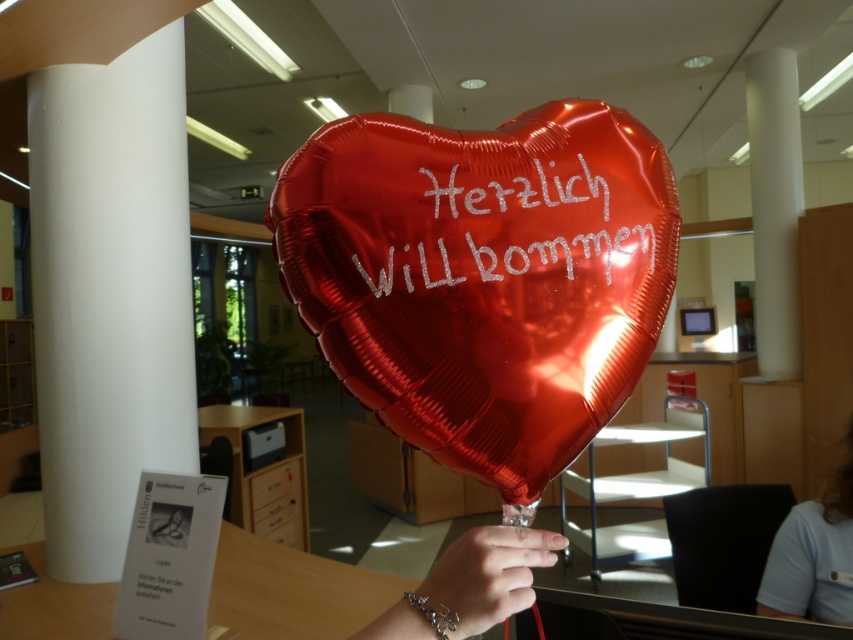
Who is lower down, white smooth pillar at left or white smooth pillar at right?

white smooth pillar at left

Which of these two, white smooth pillar at left or white smooth pillar at right, stands shorter?

white smooth pillar at left

This screenshot has width=853, height=640. What do you see at coordinates (109, 292) in the screenshot? I see `white smooth pillar at left` at bounding box center [109, 292].

Where is `white smooth pillar at left`? white smooth pillar at left is located at coordinates click(109, 292).

Which of these two, white smooth pillar at right or metallic silver bracelet at lower center, stands taller?

white smooth pillar at right is taller.

Can you confirm if white smooth pillar at right is smaller than metallic silver bracelet at lower center?

No.

Is point (759, 272) farther from viewer compared to point (488, 609)?

Yes.

Where is `white smooth pillar at right`? The height and width of the screenshot is (640, 853). white smooth pillar at right is located at coordinates (775, 209).

Which is more to the left, white smooth pillar at right or white fabric shirt at lower right?

Positioned to the left is white fabric shirt at lower right.

This screenshot has height=640, width=853. In order to click on white smooth pillar at right in this screenshot , I will do `click(775, 209)`.

The width and height of the screenshot is (853, 640). Identify the location of white smooth pillar at right. (775, 209).